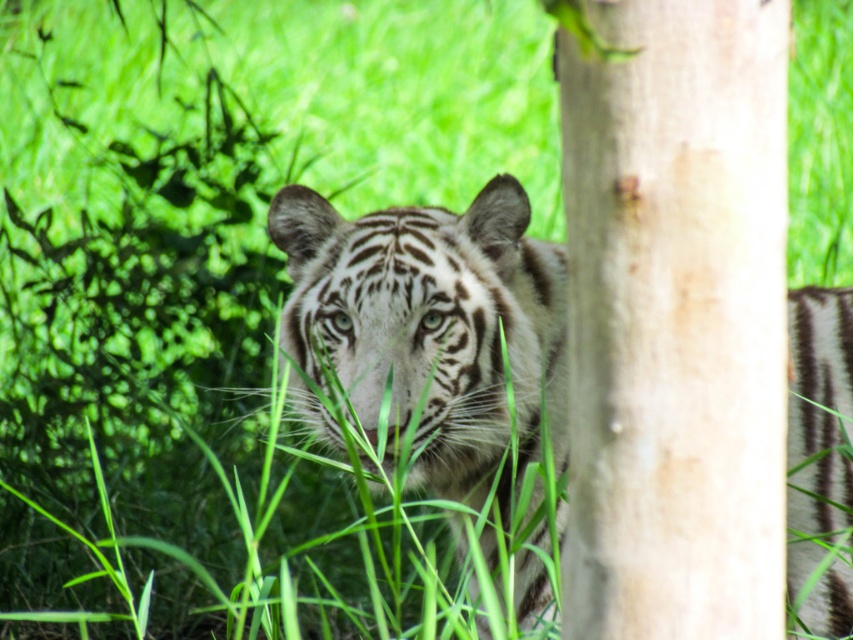
Measure the distance between smooth brown tree trunk at center-right and white striped tiger at center.

A distance of 1.70 meters exists between smooth brown tree trunk at center-right and white striped tiger at center.

Which is behind, point (695, 621) or point (320, 298)?

The point (320, 298) is behind.

Image resolution: width=853 pixels, height=640 pixels. What are the coordinates of `smooth brown tree trunk at center-right` in the screenshot? It's located at (675, 317).